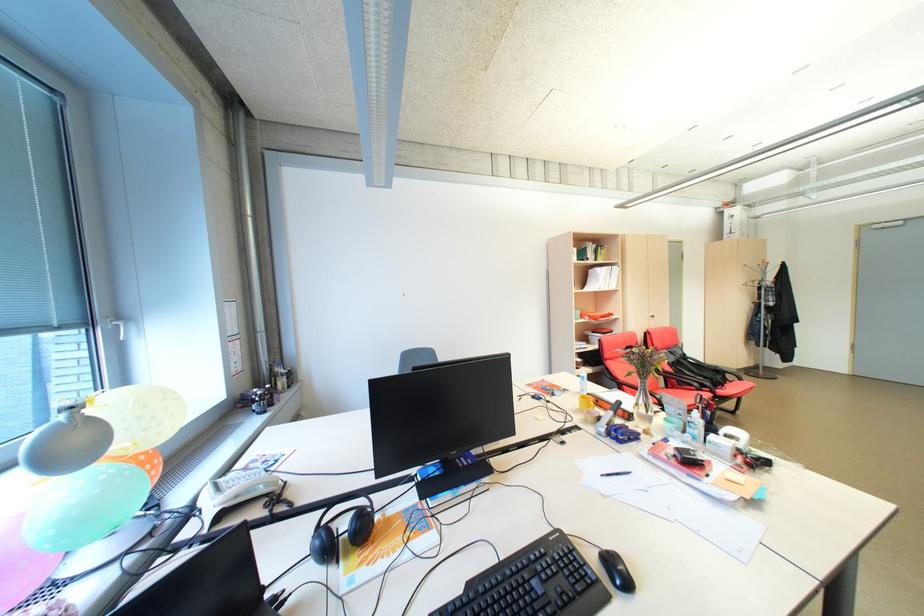
Which object does [736,436] point to?

This point indicates the clear tape dispenser.